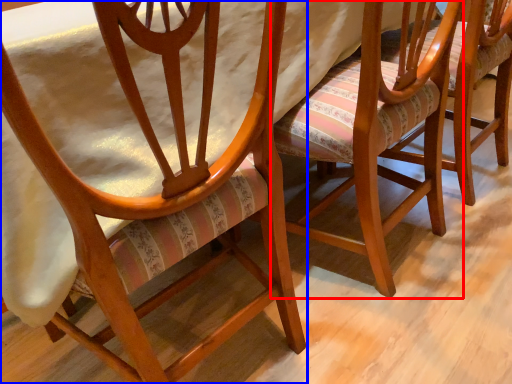
Question: Which object appears farthest to the camera in this image, chair (highlighted by a red box) or chair (highlighted by a blue box)?

Choices:
 (A) chair
 (B) chair

Answer: (A)